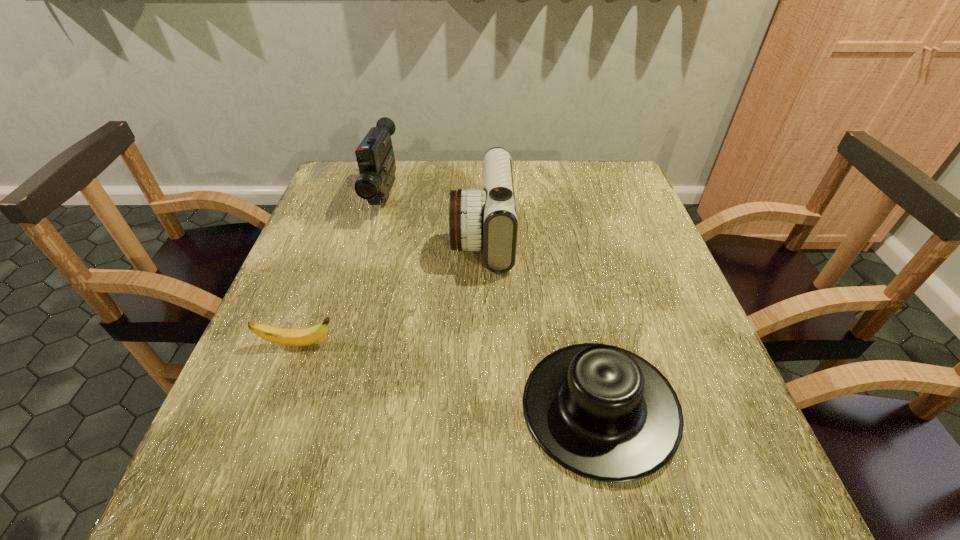
Identify the location of object that stands as the second closest to the banana. (602, 412).

Where is `object that stands as the closest to the dress hat`? The height and width of the screenshot is (540, 960). object that stands as the closest to the dress hat is located at coordinates (486, 219).

Locate an element on the screen. The image size is (960, 540). blank area in the image that satisfies the following two spatial constraints: 1. on the front-facing side of the left camcorder; 2. on the right side of the second shortest object is located at coordinates (324, 407).

Find the location of `vacant point that satisfies the following two spatial constraints: 1. on the surface of the right camcorder; 2. on the right side of the second shortest object`. vacant point that satisfies the following two spatial constraints: 1. on the surface of the right camcorder; 2. on the right side of the second shortest object is located at coordinates (484, 407).

Find the location of a particular element. free location that satisfies the following two spatial constraints: 1. on the front-facing side of the left camcorder; 2. at the stem of the shortest object is located at coordinates (342, 344).

Locate an element on the screen. This screenshot has width=960, height=540. vacant region that satisfies the following two spatial constraints: 1. on the front-facing side of the left camcorder; 2. on the left side of the dress hat is located at coordinates (324, 407).

Where is `free space that satisfies the following two spatial constraints: 1. at the stem of the banana; 2. on the right side of the third tallest object`? The height and width of the screenshot is (540, 960). free space that satisfies the following two spatial constraints: 1. at the stem of the banana; 2. on the right side of the third tallest object is located at coordinates (276, 407).

At what (x,y) coordinates should I click in order to perform the action: click on free location that satisfies the following two spatial constraints: 1. on the front-facing side of the left camcorder; 2. on the right side of the dress hat. Please return your answer as a coordinate pair (x, y). This screenshot has height=540, width=960. Looking at the image, I should click on pos(324,407).